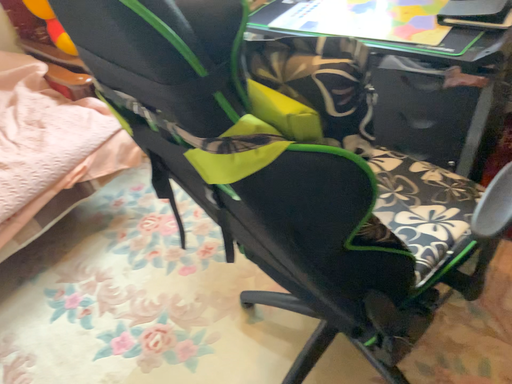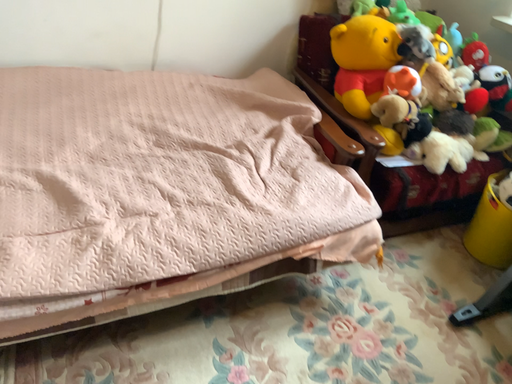
Question: Which way did the camera rotate in the video?

Choices:
 (A) rotated downward
 (B) rotated upward

Answer: (B)